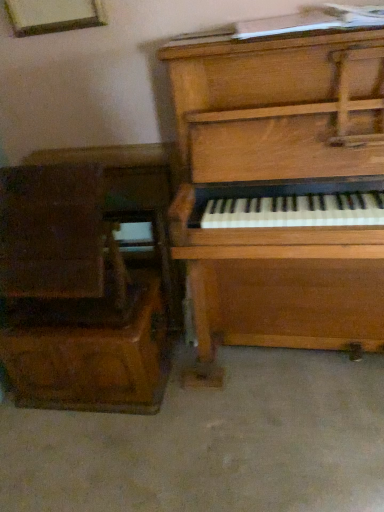
Question: In terms of size, does smooth concrete floor at lower center appear bigger or smaller than wooden drawer at left?

Choices:
 (A) small
 (B) big

Answer: (B)

Question: Considering the positions of smooth concrete floor at lower center and wooden drawer at left in the image, is smooth concrete floor at lower center wider or thinner than wooden drawer at left?

Choices:
 (A) wide
 (B) thin

Answer: (A)

Question: Based on their relative distances, which object is nearer to the wooden piano at right?

Choices:
 (A) wooden drawer at left
 (B) smooth concrete floor at lower center

Answer: (A)

Question: Which object is the closest to the wooden piano at right?

Choices:
 (A) smooth concrete floor at lower center
 (B) wooden drawer at left

Answer: (B)